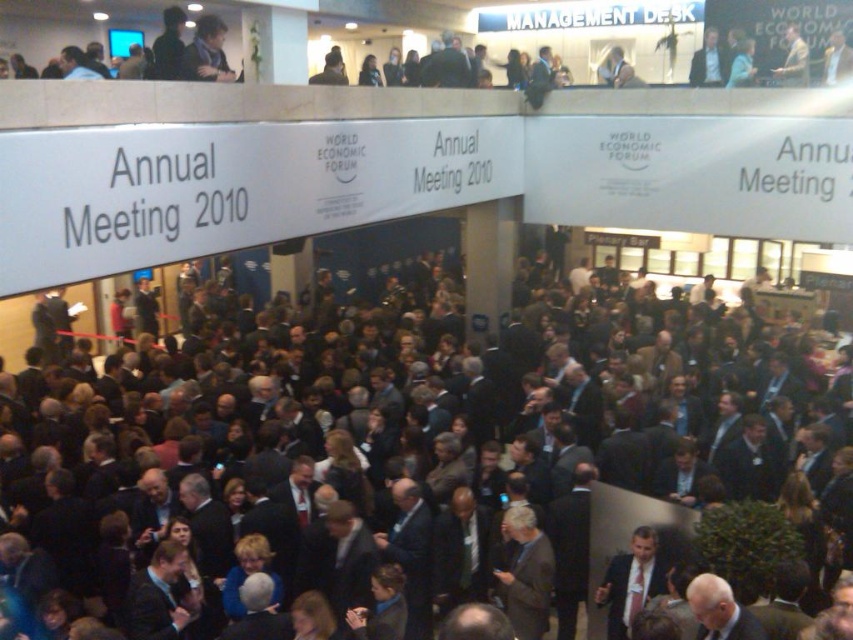
Question: Estimate the real-world distances between objects in this image. Which object is closer to the light beige suit at upper right?

Choices:
 (A) dark suit crowd at center
 (B) dark gray suit at upper center

Answer: (A)

Question: Which of the following is the farthest from the observer?

Choices:
 (A) light beige suit at upper right
 (B) dark suit crowd at center

Answer: (A)

Question: Can you confirm if dark suit crowd at center is thinner than light beige suit at upper right?

Choices:
 (A) yes
 (B) no

Answer: (B)

Question: Which of these objects is positioned farthest from the dark gray suit at upper center?

Choices:
 (A) dark suit crowd at center
 (B) light beige suit at upper right

Answer: (B)

Question: Can you confirm if dark suit crowd at center is positioned to the left of dark gray suit at upper center?

Choices:
 (A) yes
 (B) no

Answer: (B)

Question: Is dark suit crowd at center below light beige suit at upper right?

Choices:
 (A) no
 (B) yes

Answer: (B)